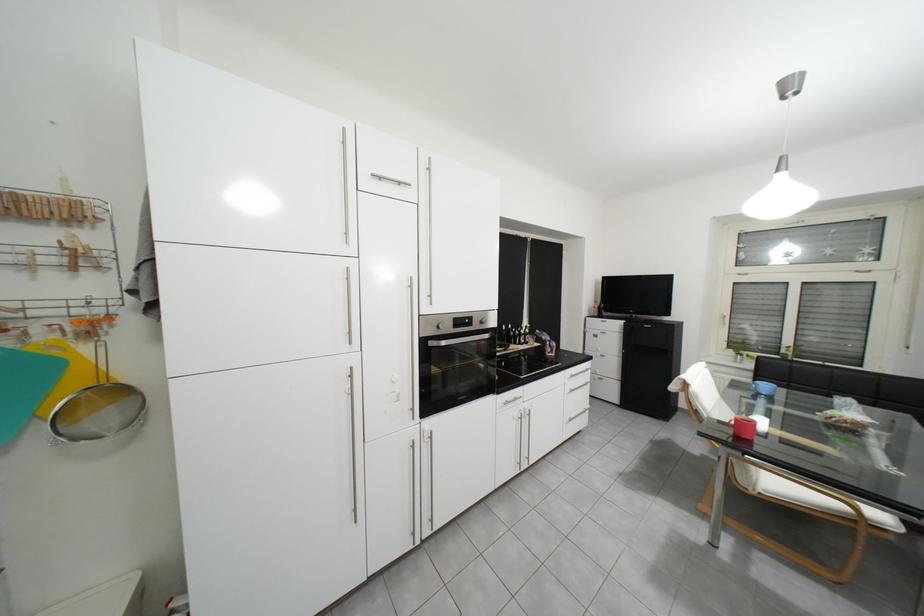
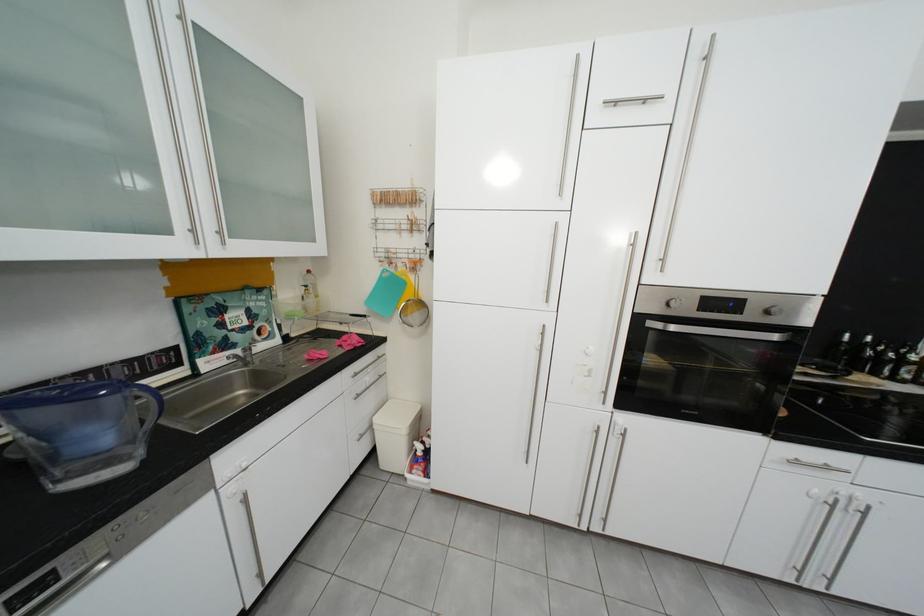
Question: The images are taken continuously from a first-person perspective. In which direction is your viewpoint rotating?

Choices:
 (A) Left
 (B) Right
 (C) Up
 (D) Down

Answer: (A)